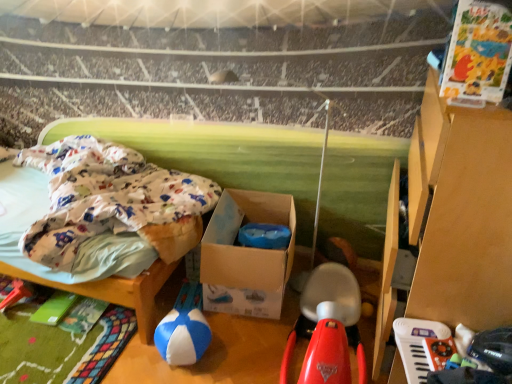
The width and height of the screenshot is (512, 384). I want to click on vacant region above white plastic keyboard at lower right, placed as the first toy when sorted from right to left (from a real-world perspective), so click(431, 346).